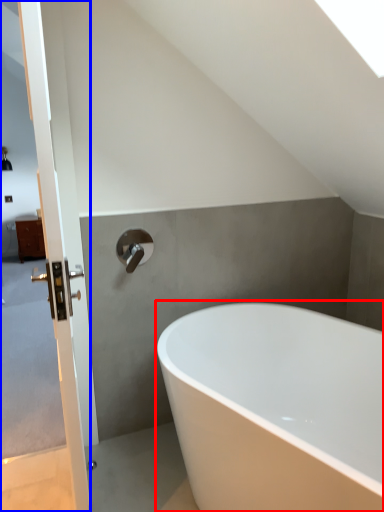
Question: Which point is further to the camera, bathtub (highlighted by a red box) or screen door (highlighted by a blue box)?

Choices:
 (A) bathtub
 (B) screen door

Answer: (A)